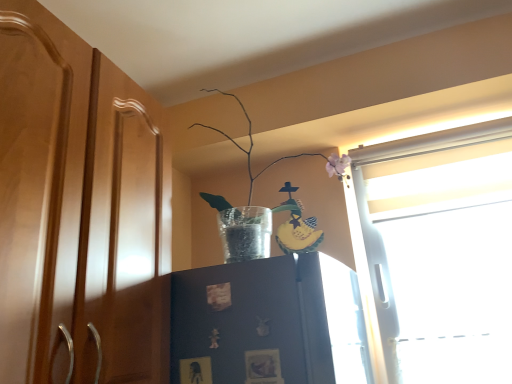
Question: From a real-world perspective, is matte dark blue cabinet at center positioned under clear glass vase at upper center based on gravity?

Choices:
 (A) yes
 (B) no

Answer: (A)

Question: Can you confirm if matte dark blue cabinet at center is thinner than clear glass vase at upper center?

Choices:
 (A) yes
 (B) no

Answer: (A)

Question: From the image's perspective, is matte dark blue cabinet at center beneath clear glass vase at upper center?

Choices:
 (A) no
 (B) yes

Answer: (B)

Question: Considering the relative positions of matte dark blue cabinet at center and clear glass vase at upper center in the image provided, is matte dark blue cabinet at center to the right of clear glass vase at upper center from the viewer's perspective?

Choices:
 (A) no
 (B) yes

Answer: (A)

Question: Does matte dark blue cabinet at center have a larger size compared to clear glass vase at upper center?

Choices:
 (A) yes
 (B) no

Answer: (B)

Question: Is matte dark blue cabinet at center next to clear glass vase at upper center?

Choices:
 (A) yes
 (B) no

Answer: (B)

Question: Can you confirm if clear glass vase at upper center is positioned to the left of matte wood dresser at center?

Choices:
 (A) no
 (B) yes

Answer: (A)

Question: From the image's perspective, is clear glass vase at upper center located above matte wood dresser at center?

Choices:
 (A) no
 (B) yes

Answer: (B)

Question: Does clear glass vase at upper center have a smaller size compared to matte wood dresser at center?

Choices:
 (A) yes
 (B) no

Answer: (A)

Question: Can you confirm if clear glass vase at upper center is shorter than matte wood dresser at center?

Choices:
 (A) no
 (B) yes

Answer: (B)

Question: Does clear glass vase at upper center touch matte wood dresser at center?

Choices:
 (A) yes
 (B) no

Answer: (B)

Question: Is clear glass vase at upper center positioned far away from matte wood dresser at center?

Choices:
 (A) no
 (B) yes

Answer: (A)

Question: From a real-world perspective, is clear glass vase at upper center physically above matte dark blue cabinet at center?

Choices:
 (A) yes
 (B) no

Answer: (A)